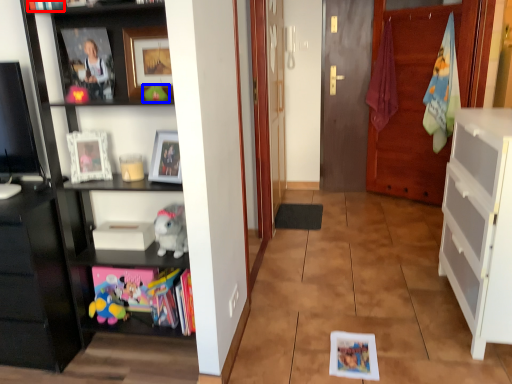
Question: Among these objects, which one is nearest to the camera, book (highlighted by a red box) or toy (highlighted by a blue box)?

Choices:
 (A) book
 (B) toy

Answer: (A)